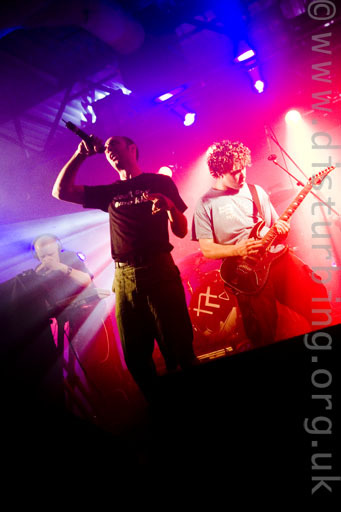
Where is `mic`? This screenshot has height=512, width=341. mic is located at coordinates point(98,148).